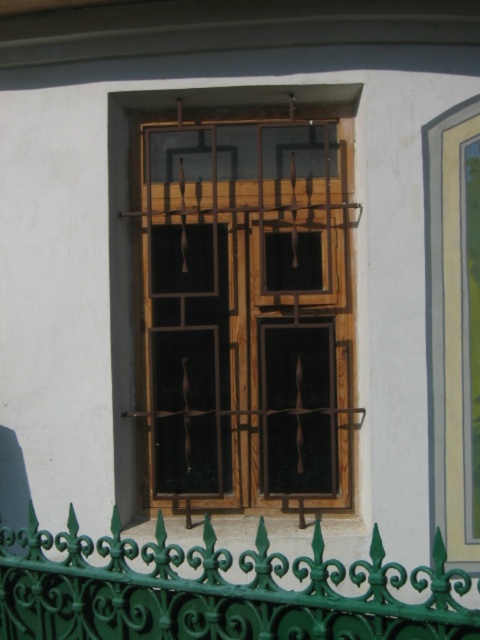
You are standing in front of a building with a unique window. There is a point marked at coordinates [247,308]. Which object does this point correspond to?

The point at coordinates [247,308] corresponds to the wooden window at center.

You are standing in front of the building and see two points marked on the wall. The first point is at coordinates point (285, 216) and the second is at point (88, 584). Which point is closer to you?

Result: Point (285, 216) is closer to you because it is further to the viewer than point (88, 584).

You are standing in front of the building and want to take a photo of the wooden window at center and the green wrought iron fence at lower center. If you want to ensure both are in the frame, which object should you position closer to the camera?

You should position the green wrought iron fence at lower center closer to the camera because the wooden window at center is to the right of the green wrought iron fence at lower center, meaning it is further away. By moving closer to the fence, both objects will be in the frame.